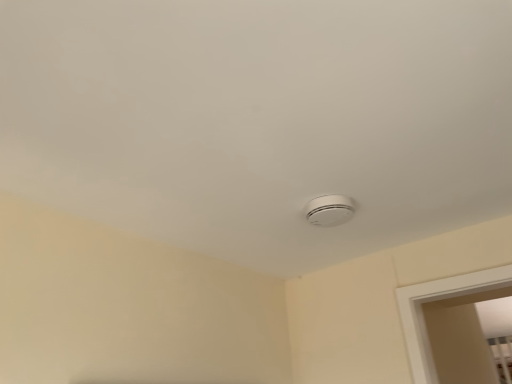
Where is `white plastic smoke detector at center`? This screenshot has width=512, height=384. white plastic smoke detector at center is located at coordinates (330, 210).

What do you see at coordinates (330, 210) in the screenshot? This screenshot has height=384, width=512. I see `white plastic smoke detector at center` at bounding box center [330, 210].

Identify the location of white plastic smoke detector at center. The height and width of the screenshot is (384, 512). (330, 210).